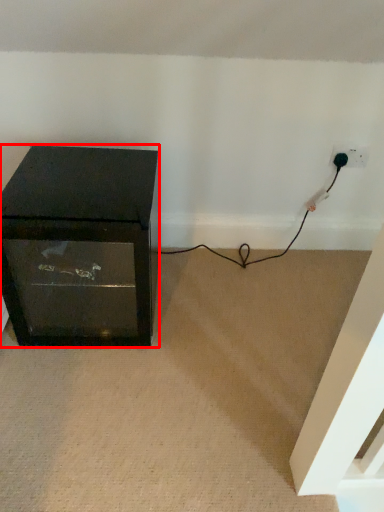
Question: Considering the relative positions of furniture (annotated by the red box) and plug in the image provided, where is furniture (annotated by the red box) located with respect to the staircase?

Choices:
 (A) left
 (B) right

Answer: (A)